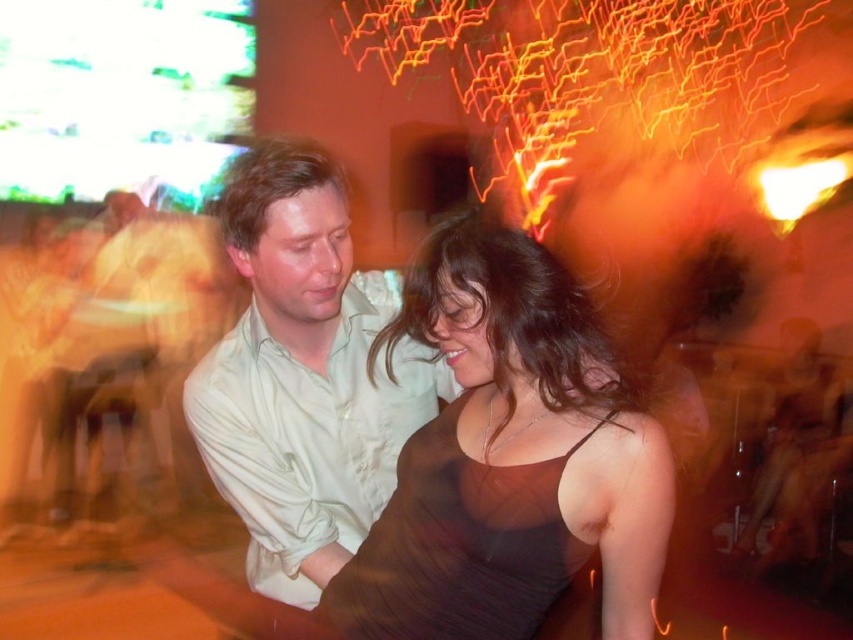
Find the location of `brown satin dress at center`. brown satin dress at center is located at coordinates pyautogui.click(x=509, y=460).

Looking at this image, which is above, brown satin dress at center or light beige shirt at center?

light beige shirt at center is above.

Is point (549, 259) closer to camera compared to point (358, 300)?

Yes, point (549, 259) is closer to viewer.

This screenshot has width=853, height=640. What are the coordinates of `brown satin dress at center` in the screenshot? It's located at (509, 460).